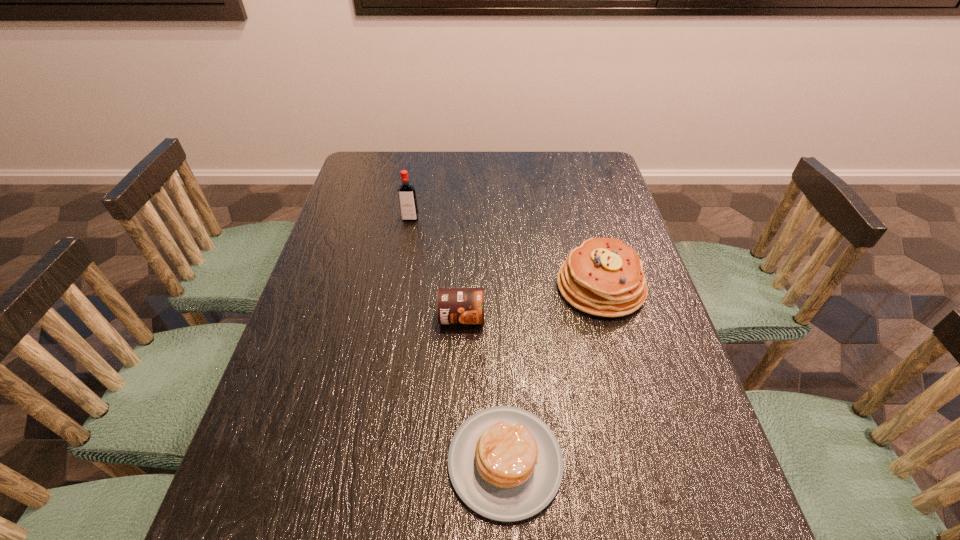
Where is `vacant space located 0.160m on the left of the nearer pancake`? The height and width of the screenshot is (540, 960). vacant space located 0.160m on the left of the nearer pancake is located at coordinates (363, 461).

The image size is (960, 540). Find the location of `object at the right edge`. object at the right edge is located at coordinates (604, 277).

In the image, there is a desktop. Where is `free space at the far edge`? free space at the far edge is located at coordinates [474, 166].

The height and width of the screenshot is (540, 960). In the image, there is a desktop. In order to click on vacant space at the left edge in this screenshot , I will do `click(337, 340)`.

Identify the location of vacant space at the right edge of the desktop. (582, 213).

I want to click on free space at the far right corner of the desktop, so click(x=571, y=172).

The height and width of the screenshot is (540, 960). In the image, there is a desktop. In order to click on vacant space at the near right corner in this screenshot , I will do `click(725, 539)`.

Find the location of a particular element. The width and height of the screenshot is (960, 540). free spot between the right pancake and the shortest object is located at coordinates [x=553, y=374].

Find the location of `vacant space in between the nearest object and the can`. vacant space in between the nearest object and the can is located at coordinates (484, 389).

You are a GUI agent. You are given a task and a screenshot of the screen. Output one action in this format:
    pyautogui.click(x=<x>, y=<y>)
    Task: Click on the free space between the third tallest object and the vodka
    
    Given the screenshot: What is the action you would take?
    pyautogui.click(x=436, y=268)